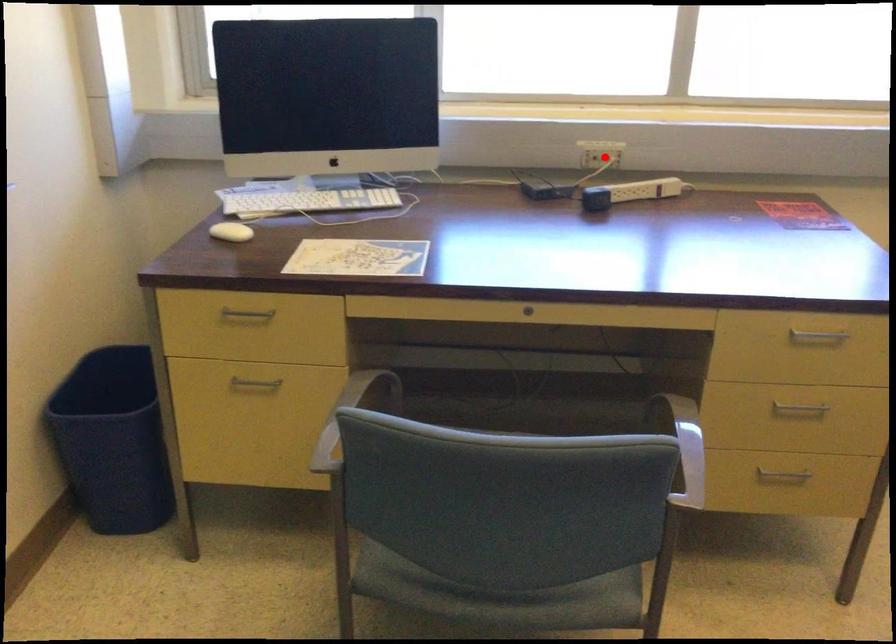
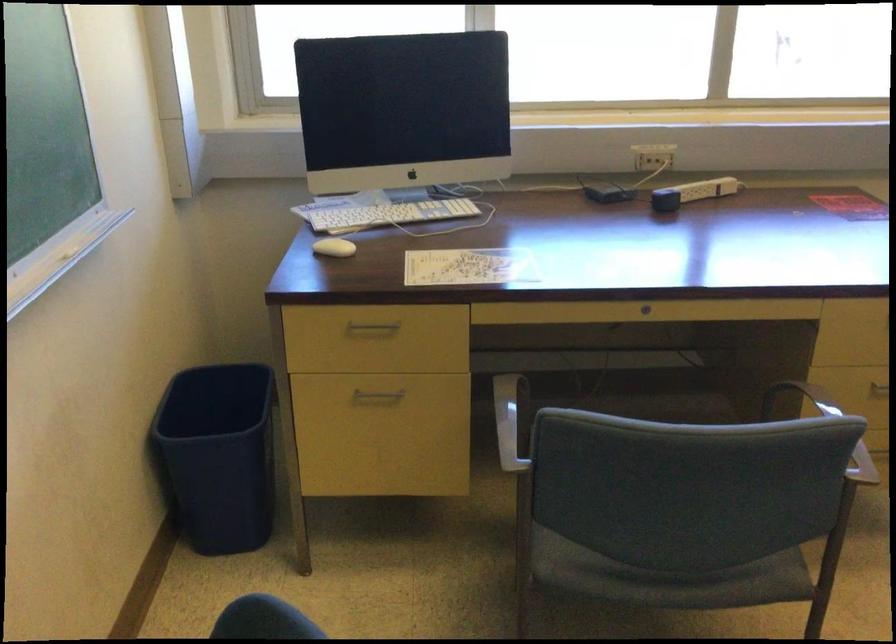
Where in the second image is the point corresponding to the highlighted location from the first image?

(658, 156)